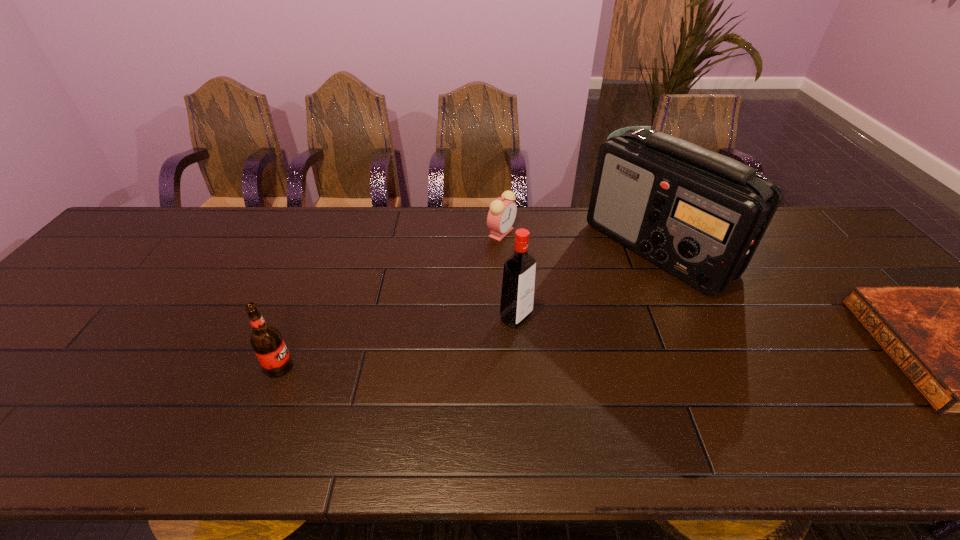
Where is `free region at the near edge of the desktop`? The image size is (960, 540). free region at the near edge of the desktop is located at coordinates (664, 394).

Locate an element on the screen. This screenshot has height=540, width=960. vacant area at the near left corner of the desktop is located at coordinates (21, 408).

The height and width of the screenshot is (540, 960). In the image, there is a desktop. Find the location of `blank space at the far right corner`. blank space at the far right corner is located at coordinates (803, 244).

Identify the location of empty location between the tallest object and the alarm clock. Image resolution: width=960 pixels, height=540 pixels. (580, 240).

Identify the location of free space that is in between the leftmost object and the alarm clock. The height and width of the screenshot is (540, 960). (391, 300).

At what (x,y) coordinates should I click in order to perform the action: click on empty space between the second object from right to left and the second shortest object. Please return your answer as a coordinate pair (x, y). This screenshot has height=540, width=960. Looking at the image, I should click on (580, 240).

At what (x,y) coordinates should I click in order to perform the action: click on vacant point located between the fourth object from left to right and the root beer. Please return your answer as a coordinate pair (x, y). This screenshot has height=540, width=960. Looking at the image, I should click on (469, 307).

The width and height of the screenshot is (960, 540). I want to click on the fourth closest object to the root beer, so click(959, 348).

This screenshot has height=540, width=960. Find the location of `object that is the nearest to the alarm clock`. object that is the nearest to the alarm clock is located at coordinates (700, 215).

Identify the location of free spot that satisfies the following two spatial constraints: 1. on the back side of the leftmost object; 2. on the left side of the fourth object from left to right. (328, 248).